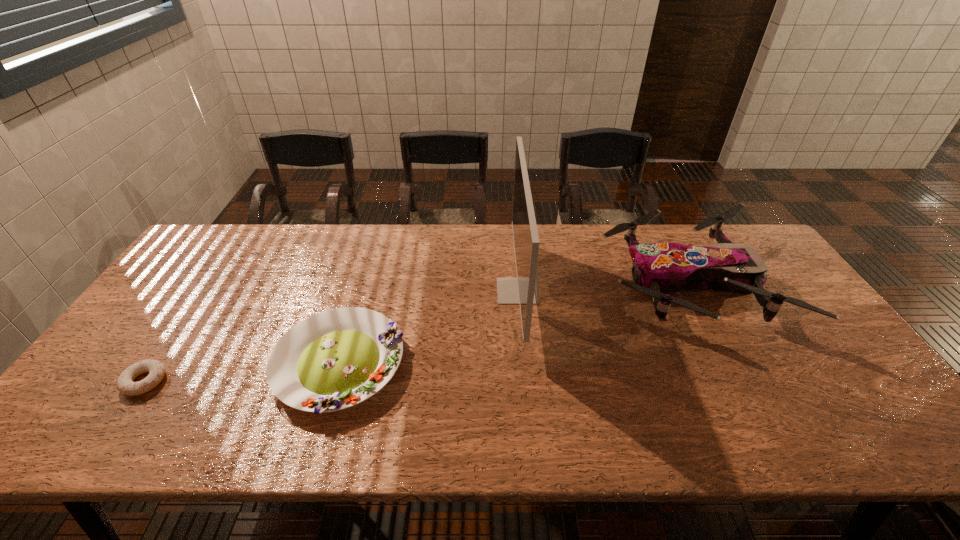
The width and height of the screenshot is (960, 540). I want to click on empty location between the doughnut and the second shortest object, so click(242, 373).

Locate an element on the screen. free space between the third tallest object and the doughnut is located at coordinates (242, 373).

The image size is (960, 540). Find the location of `free space between the rightmost object and the third object from left to right`. free space between the rightmost object and the third object from left to right is located at coordinates (602, 287).

The image size is (960, 540). What are the coordinates of `blank region between the rightmost object and the third object from left to right` in the screenshot? It's located at (602, 287).

The height and width of the screenshot is (540, 960). In order to click on free space between the doughnut and the second shortest object in this screenshot , I will do `click(242, 373)`.

Locate an element on the screen. vacant point located between the monitor and the second object from left to right is located at coordinates (428, 327).

Locate which object is the third closest to the third object from left to right. Please provide its 2D coordinates. Your answer should be formatted as a tuple, i.e. [(x, y)], where the tuple contains the x and y coordinates of a point satisfying the conditions above.

[(156, 369)]

Identify which object is the second nearest to the tallest object. Please provide its 2D coordinates. Your answer should be formatted as a tuple, i.e. [(x, y)], where the tuple contains the x and y coordinates of a point satisfying the conditions above.

[(335, 359)]

Locate an element on the screen. This screenshot has width=960, height=540. free space that satisfies the following two spatial constraints: 1. on the front-facing side of the second tallest object; 2. on the front side of the second object from left to right is located at coordinates tap(729, 364).

Locate an element on the screen. free space in the image that satisfies the following two spatial constraints: 1. on the front-facing side of the drone; 2. on the front side of the doughnut is located at coordinates (738, 381).